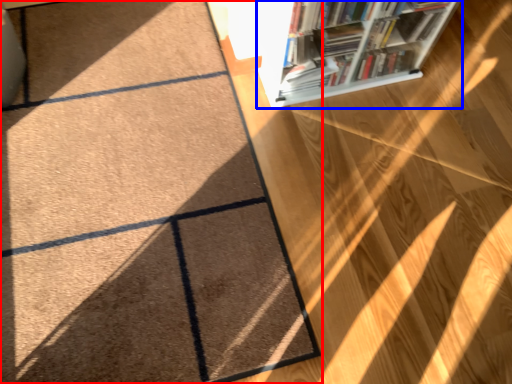
Question: Which object appears farthest to the camera in this image, doormat (highlighted by a red box) or bookcase (highlighted by a blue box)?

Choices:
 (A) doormat
 (B) bookcase

Answer: (B)